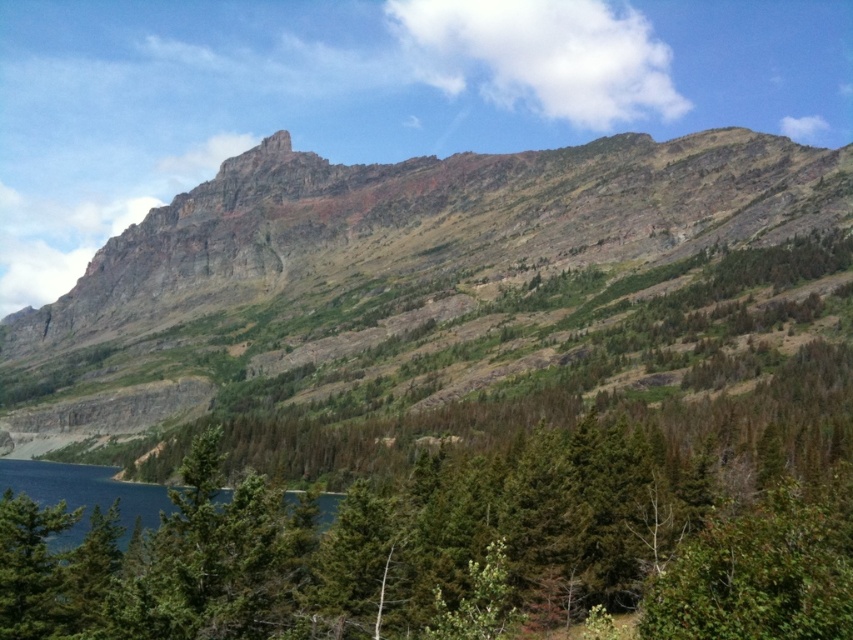
Does rugged stone mountain at upper center come behind deep blue water at lower left?

Yes, it is.

Locate an element on the screen. The width and height of the screenshot is (853, 640). rugged stone mountain at upper center is located at coordinates (434, 296).

Between point (332, 516) and point (18, 541), which one is positioned behind?

The point (332, 516) is behind.

Does deep blue water at lower left appear over green matte tree at lower left?

Actually, deep blue water at lower left is below green matte tree at lower left.

Is point (151, 522) closer to camera compared to point (16, 608)?

That is False.

Locate an element on the screen. deep blue water at lower left is located at coordinates (84, 496).

Is rugged stone mountain at upper center to the right of green matte tree at lower left from the viewer's perspective?

Correct, you'll find rugged stone mountain at upper center to the right of green matte tree at lower left.

Which is more to the right, rugged stone mountain at upper center or green matte tree at lower left?

From the viewer's perspective, rugged stone mountain at upper center appears more on the right side.

Identify the location of rugged stone mountain at upper center. This screenshot has height=640, width=853. (434, 296).